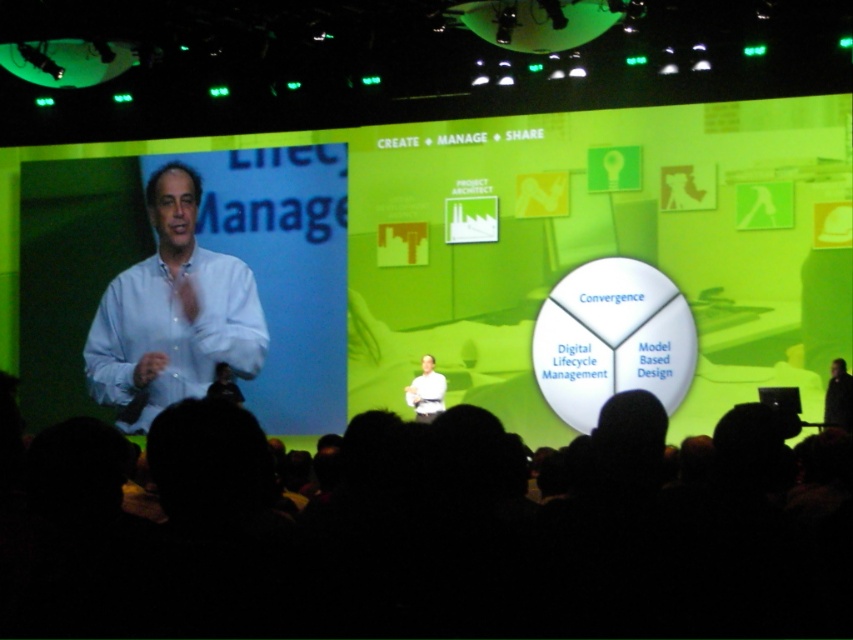
Can you confirm if black fabric at lower center is bigger than light blue shirt at left?

Indeed, black fabric at lower center has a larger size compared to light blue shirt at left.

Is black fabric at lower center in front of light blue shirt at left?

That is True.

Describe the element at coordinates (413, 536) in the screenshot. The width and height of the screenshot is (853, 640). I see `black fabric at lower center` at that location.

What are the coordinates of `black fabric at lower center` in the screenshot? It's located at (413, 536).

Does light blue shirt at left appear over white matte shirt at center?

Yes, light blue shirt at left is above white matte shirt at center.

Between point (160, 257) and point (410, 394), which one is positioned in front?

Positioned in front is point (410, 394).

Locate an element on the screen. This screenshot has height=640, width=853. light blue shirt at left is located at coordinates (172, 314).

Is black fabric at lower center wider than white matte shirt at center?

Indeed, black fabric at lower center has a greater width compared to white matte shirt at center.

Between black fabric at lower center and white matte shirt at center, which one has less height?

With less height is white matte shirt at center.

The width and height of the screenshot is (853, 640). What do you see at coordinates (413, 536) in the screenshot?
I see `black fabric at lower center` at bounding box center [413, 536].

The image size is (853, 640). I want to click on black fabric at lower center, so click(413, 536).